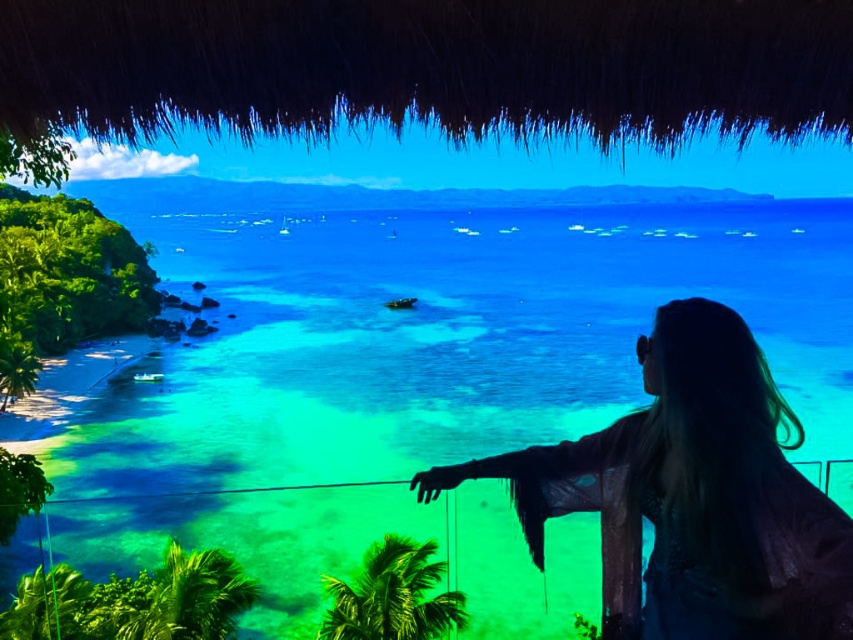
Question: Which of the following is the farthest from the observer?

Choices:
 (A) (308, 384)
 (B) (598, 435)

Answer: (A)

Question: Does translucent blue water at center appear under silky black hair at upper right?

Choices:
 (A) no
 (B) yes

Answer: (A)

Question: Which point is farther to the camera?

Choices:
 (A) (337, 476)
 (B) (457, 474)

Answer: (A)

Question: Can you confirm if translucent blue water at center is positioned to the left of silky black hair at upper right?

Choices:
 (A) no
 (B) yes

Answer: (B)

Question: Is translucent blue water at center wider than silky black hair at upper right?

Choices:
 (A) yes
 (B) no

Answer: (A)